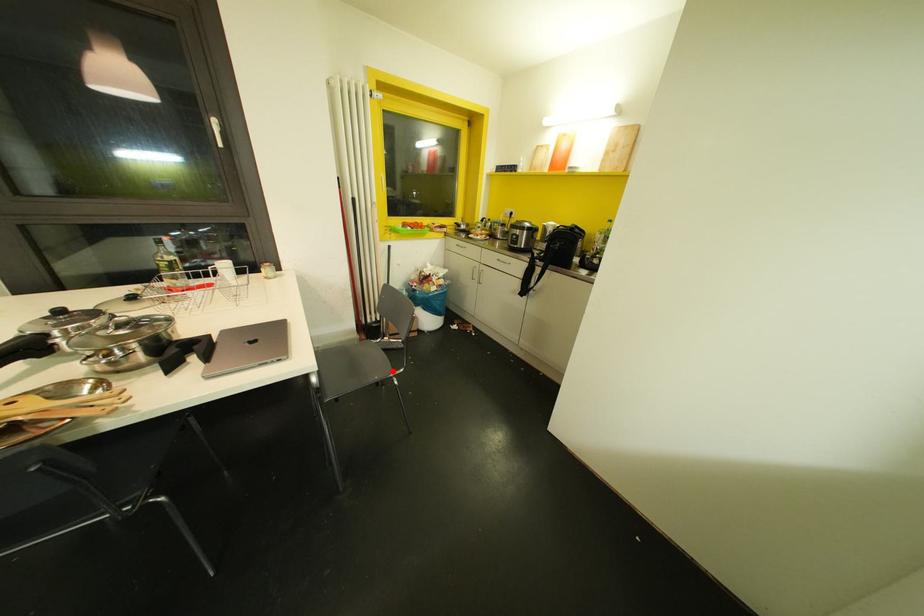
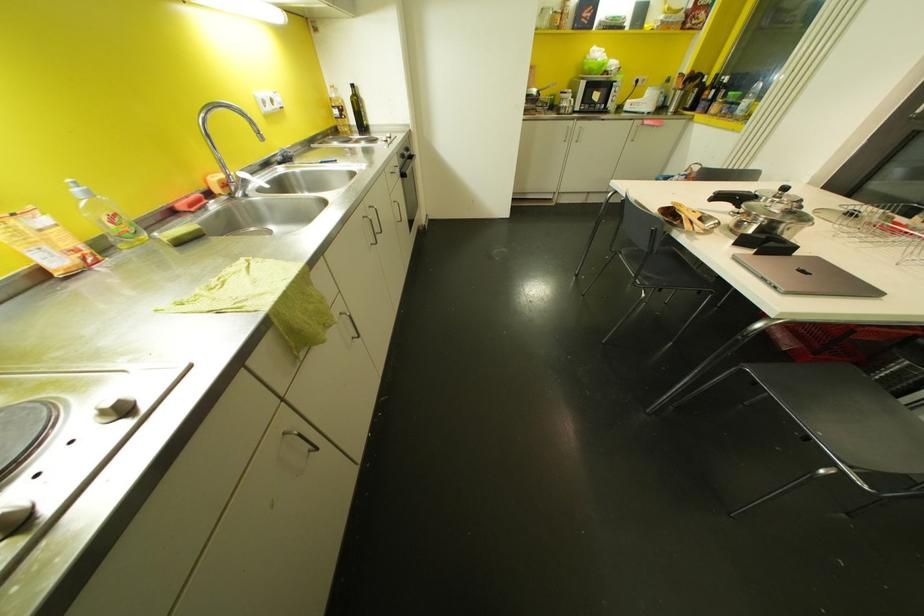
Question: I am providing you with two images of the same scene from different viewpoints. A red point is shown in image1. For the corresponding object point in image2, is it positioned nearer or farther from the camera?

Choices:
 (A) Nearer
 (B) Farther

Answer: (B)